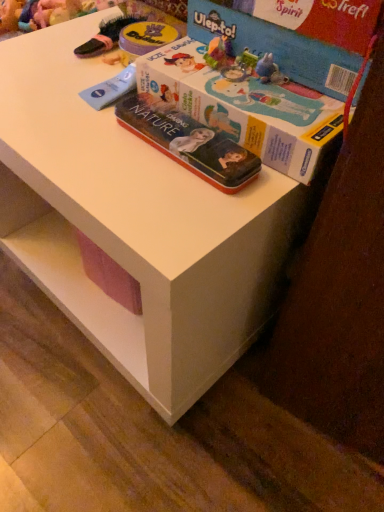
Question: In terms of height, does cardboard box at upper right, the first box viewed from the top, look taller or shorter compared to metallic tin box at center?

Choices:
 (A) tall
 (B) short

Answer: (A)

Question: Considering the positions of cardboard box at upper right, placed as the 2th box when sorted from bottom to top, and metallic tin box at center in the image, is cardboard box at upper right, placed as the 2th box when sorted from bottom to top, bigger or smaller than metallic tin box at center?

Choices:
 (A) small
 (B) big

Answer: (B)

Question: Which of these objects is positioned closest to the cardboard box at upper right, the first box viewed from the top?

Choices:
 (A) metallic tin box at center
 (B) blue cardboard box at upper right, which is counted as the 2th box, starting from the top

Answer: (B)

Question: Which object is positioned farthest from the blue cardboard box at upper right, marked as the first box in a bottom-to-top arrangement?

Choices:
 (A) metallic tin box at center
 (B) cardboard box at upper right, the first box viewed from the top

Answer: (B)